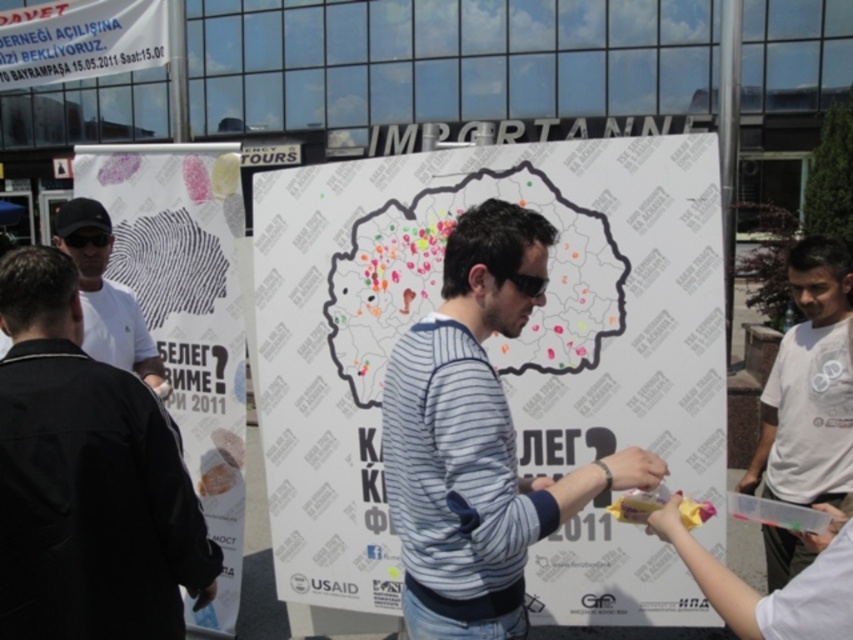
Question: Which point is closer to the camera?

Choices:
 (A) (200, 353)
 (B) (325, 596)
 (C) (787, 461)
 (D) (128, 300)

Answer: (C)

Question: Which object appears closest to the camera in this image?

Choices:
 (A) white matte shirt at left
 (B) white paper poster at left
 (C) white cotton t-shirt at right

Answer: (C)

Question: Which is nearer to the white paper poster at left?

Choices:
 (A) white paper map at center
 (B) white matte shirt at left
 (C) white cotton t-shirt at right

Answer: (B)

Question: Is white paper poster at left positioned in front of white cotton t-shirt at right?

Choices:
 (A) no
 (B) yes

Answer: (A)

Question: Observing the image, what is the correct spatial positioning of white paper map at center in reference to white matte shirt at left?

Choices:
 (A) above
 (B) below

Answer: (B)

Question: Is white paper map at center above white paper poster at left?

Choices:
 (A) yes
 (B) no

Answer: (B)